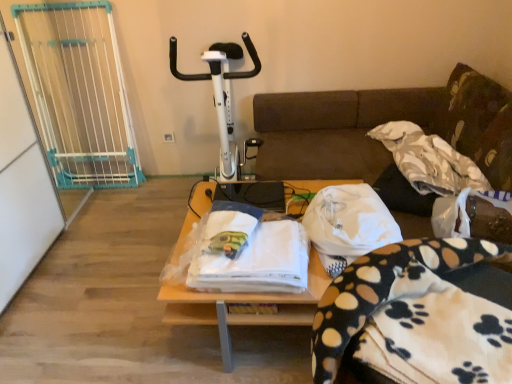
Question: Is white fleece blanket with paw prints at lower right, positioned as the second blanket in right-to-left order, wider than white fabric at center?

Choices:
 (A) no
 (B) yes

Answer: (B)

Question: Is white fleece blanket with paw prints at lower right, the 2th blanket from the left, turned away from white fabric at center?

Choices:
 (A) no
 (B) yes

Answer: (A)

Question: Can you confirm if white fleece blanket with paw prints at lower right, the 2th blanket from the left, is shorter than white fabric at center?

Choices:
 (A) no
 (B) yes

Answer: (A)

Question: Would you say white fleece blanket with paw prints at lower right, acting as the 3th blanket starting from the back, is outside white fabric at center?

Choices:
 (A) no
 (B) yes

Answer: (B)

Question: Is white fleece blanket with paw prints at lower right, acting as the 1th blanket starting from the front, thinner than white fabric at center?

Choices:
 (A) yes
 (B) no

Answer: (B)

Question: Would you consider white fleece blanket with paw prints at lower right, acting as the 1th blanket starting from the front, to be distant from white fabric at center?

Choices:
 (A) no
 (B) yes

Answer: (A)

Question: Does white fabric at center have a larger size compared to white textured blanket at upper right, which is the 3th blanket in left-to-right order?

Choices:
 (A) yes
 (B) no

Answer: (B)

Question: Is white fabric at center wider than white textured blanket at upper right, which is the 3th blanket in left-to-right order?

Choices:
 (A) yes
 (B) no

Answer: (A)

Question: Can you confirm if white fabric at center is positioned to the right of white textured blanket at upper right, which is the 3th blanket in left-to-right order?

Choices:
 (A) yes
 (B) no

Answer: (B)

Question: From the image's perspective, would you say white fabric at center is shown under white textured blanket at upper right, which appears as the 1th blanket when viewed from the back?

Choices:
 (A) yes
 (B) no

Answer: (A)

Question: Considering the relative sizes of white fabric at center and white textured blanket at upper right, which appears as the 1th blanket when viewed from the back, in the image provided, is white fabric at center thinner than white textured blanket at upper right, which appears as the 1th blanket when viewed from the back,?

Choices:
 (A) no
 (B) yes

Answer: (A)

Question: Does white fabric at center appear on the left side of white textured blanket at upper right, which is the 3th blanket in left-to-right order?

Choices:
 (A) no
 (B) yes

Answer: (B)

Question: Can you confirm if white plastic exercise bike at center is bigger than white fabric at center?

Choices:
 (A) no
 (B) yes

Answer: (B)